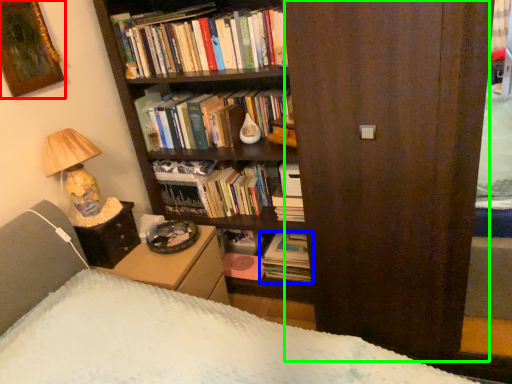
Question: Based on their relative distances, which object is nearer to picture frame (highlighted by a red box)? Choose from book (highlighted by a blue box) and screen door (highlighted by a green box).

Choices:
 (A) book
 (B) screen door

Answer: (B)